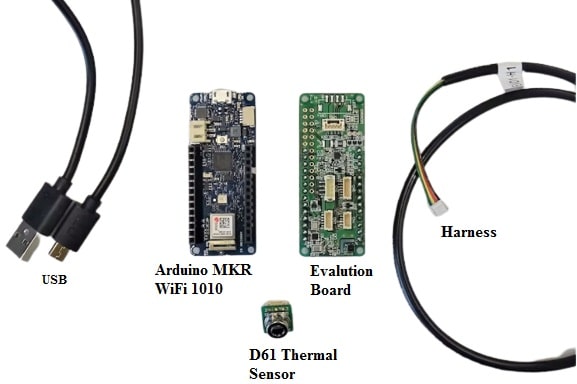
The height and width of the screenshot is (384, 577). What are the coordinates of `usb cable` in the screenshot? It's located at (63, 212), (78, 217).